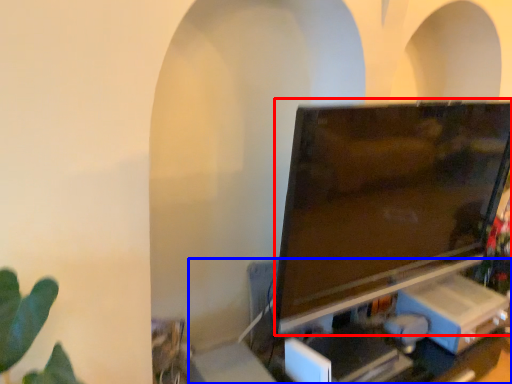
Question: Which object appears closest to the camera in this image, television (highlighted by a red box) or computer desk (highlighted by a blue box)?

Choices:
 (A) television
 (B) computer desk

Answer: (A)